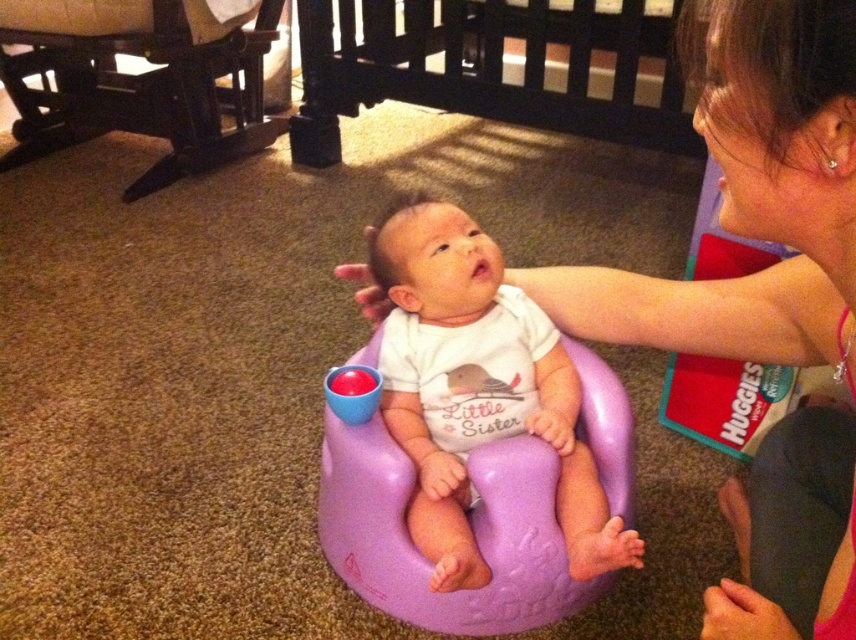
Question: Which point appears closest to the camera in this image?

Choices:
 (A) (528, 49)
 (B) (765, 115)

Answer: (B)

Question: Among these objects, which one is farthest from the camera?

Choices:
 (A) purple plastic baby seat at center
 (B) dark wood crib at upper center

Answer: (B)

Question: Does dark wood crib at upper center come behind dark wood rocking chair at lower left?

Choices:
 (A) no
 (B) yes

Answer: (A)

Question: Can you confirm if purple plastic baby seat at center is wider than dark wood crib at upper center?

Choices:
 (A) yes
 (B) no

Answer: (B)

Question: Is pink fabric at upper right positioned behind purple plastic baby seat at center?

Choices:
 (A) yes
 (B) no

Answer: (B)

Question: Among these objects, which one is nearest to the camera?

Choices:
 (A) purple plastic baby seat at center
 (B) pink fabric at upper right

Answer: (B)